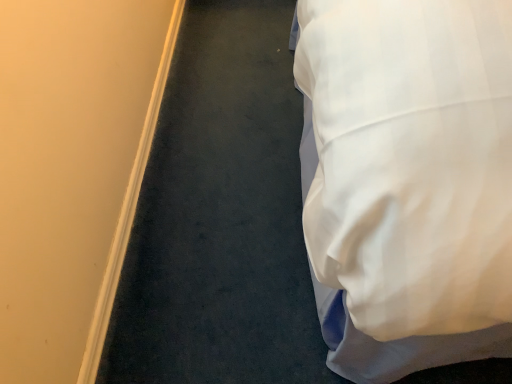
What do you see at coordinates (407, 180) in the screenshot?
I see `white satin bed at right` at bounding box center [407, 180].

You are a GUI agent. You are given a task and a screenshot of the screen. Output one action in this format:
    pyautogui.click(x=<x>, y=<y>)
    Task: Click on the white satin bed at right
    
    Given the screenshot: What is the action you would take?
    pyautogui.click(x=407, y=180)

Where is `white satin bed at right`? This screenshot has height=384, width=512. white satin bed at right is located at coordinates (407, 180).